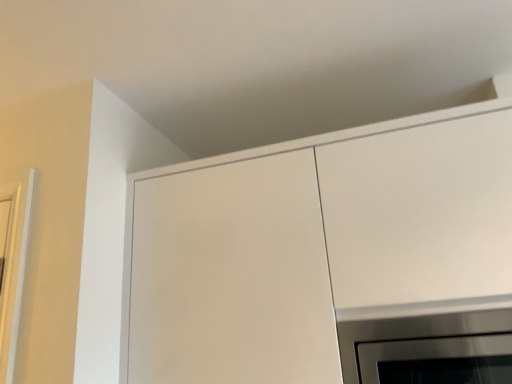
What do you see at coordinates (324, 252) in the screenshot? I see `white matte cabinet at upper center` at bounding box center [324, 252].

This screenshot has height=384, width=512. Find the location of `white matte cabinet at upper center`. white matte cabinet at upper center is located at coordinates (324, 252).

Measure the distance between point (141,299) and camera.

They are 4.13 feet apart.

Locate an element on the screen. The height and width of the screenshot is (384, 512). stainless steel oven at lower right is located at coordinates (414, 331).

This screenshot has width=512, height=384. What do you see at coordinates (414, 331) in the screenshot?
I see `stainless steel oven at lower right` at bounding box center [414, 331].

In order to click on white matte cabinet at upper center in this screenshot , I will do `click(324, 252)`.

Which is more to the right, white matte cabinet at upper center or stainless steel oven at lower right?

stainless steel oven at lower right.

Is white matte cabinet at upper center closer to camera compared to stainless steel oven at lower right?

Yes.

Considering the positions of point (347, 142) and point (489, 324), is point (347, 142) closer or farther from the camera than point (489, 324)?

Point (347, 142) is farther from the camera than point (489, 324).

From the image's perspective, between white matte cabinet at upper center and stainless steel oven at lower right, who is located below?

stainless steel oven at lower right is shown below in the image.

From a real-world perspective, does white matte cabinet at upper center stand above stainless steel oven at lower right?

Yes, from a real-world perspective, white matte cabinet at upper center is above stainless steel oven at lower right.

Is white matte cabinet at upper center thinner than stainless steel oven at lower right?

No, white matte cabinet at upper center is not thinner than stainless steel oven at lower right.

Which of these two, white matte cabinet at upper center or stainless steel oven at lower right, stands shorter?

Standing shorter between the two is stainless steel oven at lower right.

Between white matte cabinet at upper center and stainless steel oven at lower right, which one has smaller size?

Smaller between the two is stainless steel oven at lower right.

Is stainless steel oven at lower right completely or partially inside white matte cabinet at upper center?

Yes, stainless steel oven at lower right is a part of white matte cabinet at upper center.

Is white matte cabinet at upper center next to stainless steel oven at lower right?

No, white matte cabinet at upper center is not beside stainless steel oven at lower right.

Is white matte cabinet at upper center positioned with its back to stainless steel oven at lower right?

Correct, white matte cabinet at upper center is looking away from stainless steel oven at lower right.

What's the angular difference between white matte cabinet at upper center and stainless steel oven at lower right's facing directions?

The facing directions of white matte cabinet at upper center and stainless steel oven at lower right are 0.633 degrees apart.

Measure the distance between white matte cabinet at upper center and stainless steel oven at lower right.

white matte cabinet at upper center is 23.55 centimeters away from stainless steel oven at lower right.

You are a GUI agent. You are given a task and a screenshot of the screen. Output one action in this format:
    pyautogui.click(x=<x>, y=<y>)
    Task: Click on the appliance behind the white matte cabinet at upper center
    
    Given the screenshot: What is the action you would take?
    pyautogui.click(x=414, y=331)

Which is more to the left, stainless steel oven at lower right or white matte cabinet at upper center?

white matte cabinet at upper center is more to the left.

Who is more distant, stainless steel oven at lower right or white matte cabinet at upper center?

stainless steel oven at lower right is further from the camera.

Considering the points (398, 334) and (178, 217), which point is behind, point (398, 334) or point (178, 217)?

The point (178, 217) is farther from the camera.

From the image's perspective, which is above, stainless steel oven at lower right or white matte cabinet at upper center?

white matte cabinet at upper center appears higher in the image.

From a real-world perspective, is stainless steel oven at lower right over white matte cabinet at upper center?

A: Actually, stainless steel oven at lower right is physically below white matte cabinet at upper center in the real world.

Considering the sizes of objects stainless steel oven at lower right and white matte cabinet at upper center in the image provided, who is wider, stainless steel oven at lower right or white matte cabinet at upper center?

With larger width is white matte cabinet at upper center.

Considering the sizes of objects stainless steel oven at lower right and white matte cabinet at upper center in the image provided, who is shorter, stainless steel oven at lower right or white matte cabinet at upper center?

stainless steel oven at lower right is shorter.

Considering the sizes of stainless steel oven at lower right and white matte cabinet at upper center in the image, is stainless steel oven at lower right bigger or smaller than white matte cabinet at upper center?

stainless steel oven at lower right is smaller than white matte cabinet at upper center.

Is stainless steel oven at lower right inside the boundaries of white matte cabinet at upper center, or outside?

stainless steel oven at lower right is inside white matte cabinet at upper center.

Is stainless steel oven at lower right positioned far away from white matte cabinet at upper center?

Actually, stainless steel oven at lower right and white matte cabinet at upper center are a little close together.

Is white matte cabinet at upper center at the back of stainless steel oven at lower right?

Absolutely, stainless steel oven at lower right is directed away from white matte cabinet at upper center.

At what (x,y) coordinates should I click in order to perform the action: click on cabinetry that appears on the left of stainless steel oven at lower right. Please return your answer as a coordinate pair (x, y). Looking at the image, I should click on (324, 252).

Where is `appliance lying behind the white matte cabinet at upper center`? The width and height of the screenshot is (512, 384). appliance lying behind the white matte cabinet at upper center is located at coordinates (414, 331).

The image size is (512, 384). What are the coordinates of `cabinetry that is above the stainless steel oven at lower right (from a real-world perspective)` in the screenshot? It's located at (324, 252).